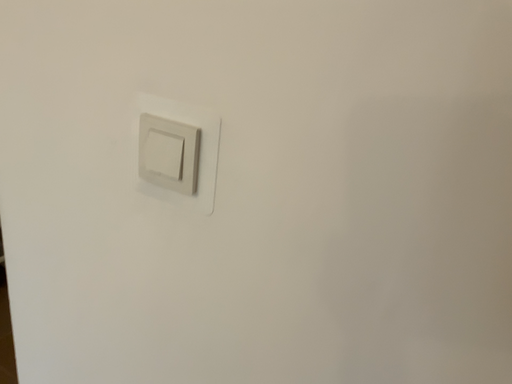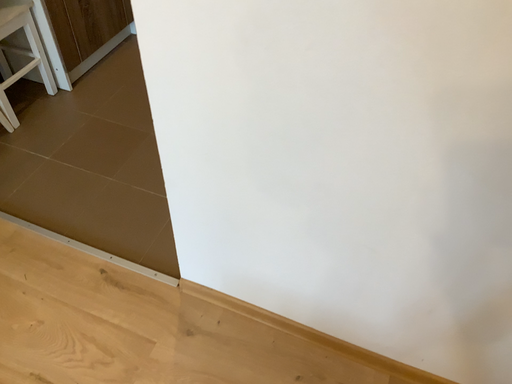
Question: How did the camera likely rotate when shooting the video?

Choices:
 (A) rotated upward
 (B) rotated downward

Answer: (B)